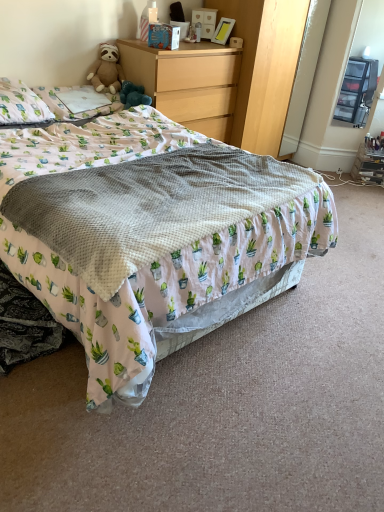
Question: Does white cotton pillow at upper left, the 1th pillow positioned from the right, come behind wooden dresser at upper center?

Choices:
 (A) no
 (B) yes

Answer: (A)

Question: Does white cotton pillow at upper left, the 1th pillow positioned from the right, touch wooden dresser at upper center?

Choices:
 (A) yes
 (B) no

Answer: (B)

Question: From the image's perspective, is white cotton pillow at upper left, the 1th pillow positioned from the right, beneath wooden dresser at upper center?

Choices:
 (A) no
 (B) yes

Answer: (B)

Question: Considering the relative positions of white cotton pillow at upper left, the 1th pillow positioned from the right, and wooden dresser at upper center in the image provided, is white cotton pillow at upper left, the 1th pillow positioned from the right, in front of wooden dresser at upper center?

Choices:
 (A) yes
 (B) no

Answer: (A)

Question: Is white cotton pillow at upper left, the 2th pillow when ordered from left to right, far away from wooden dresser at upper center?

Choices:
 (A) yes
 (B) no

Answer: (B)

Question: Considering the positions of point (187, 77) and point (0, 110), is point (187, 77) closer or farther from the camera than point (0, 110)?

Choices:
 (A) farther
 (B) closer

Answer: (A)

Question: Looking at their shapes, would you say wooden chest of drawers at upper center is wider or thinner than white fabric pillow at upper left, which is counted as the 1th pillow, starting from the left?

Choices:
 (A) thin
 (B) wide

Answer: (B)

Question: Is wooden chest of drawers at upper center inside or outside of white fabric pillow at upper left, the 2th pillow when ordered from right to left?

Choices:
 (A) inside
 (B) outside

Answer: (B)

Question: Is wooden chest of drawers at upper center in front of or behind white fabric pillow at upper left, the 2th pillow when ordered from right to left, in the image?

Choices:
 (A) front
 (B) behind

Answer: (B)

Question: From their relative heights in the image, would you say wooden dresser at upper center is taller or shorter than white printed blanket at center?

Choices:
 (A) short
 (B) tall

Answer: (B)

Question: From the image's perspective, relative to white printed blanket at center, is wooden dresser at upper center above or below?

Choices:
 (A) below
 (B) above

Answer: (B)

Question: Considering the positions of point (236, 71) and point (107, 260), is point (236, 71) closer or farther from the camera than point (107, 260)?

Choices:
 (A) closer
 (B) farther

Answer: (B)

Question: Is wooden dresser at upper center spatially inside white printed blanket at center, or outside of it?

Choices:
 (A) outside
 (B) inside

Answer: (A)

Question: Is soft brown teddy bear at upper left spatially inside wooden dresser at upper center, or outside of it?

Choices:
 (A) outside
 (B) inside

Answer: (A)

Question: Considering their positions, is soft brown teddy bear at upper left located in front of or behind wooden dresser at upper center?

Choices:
 (A) behind
 (B) front

Answer: (B)